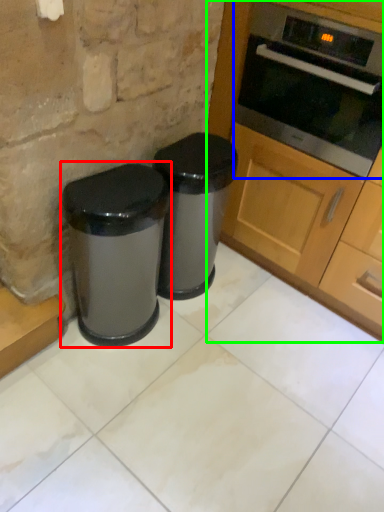
Question: Considering the real-world distances, which object is farthest from waste container (highlighted by a red box)? oven (highlighted by a blue box) or cabinetry (highlighted by a green box)?

Choices:
 (A) oven
 (B) cabinetry

Answer: (A)